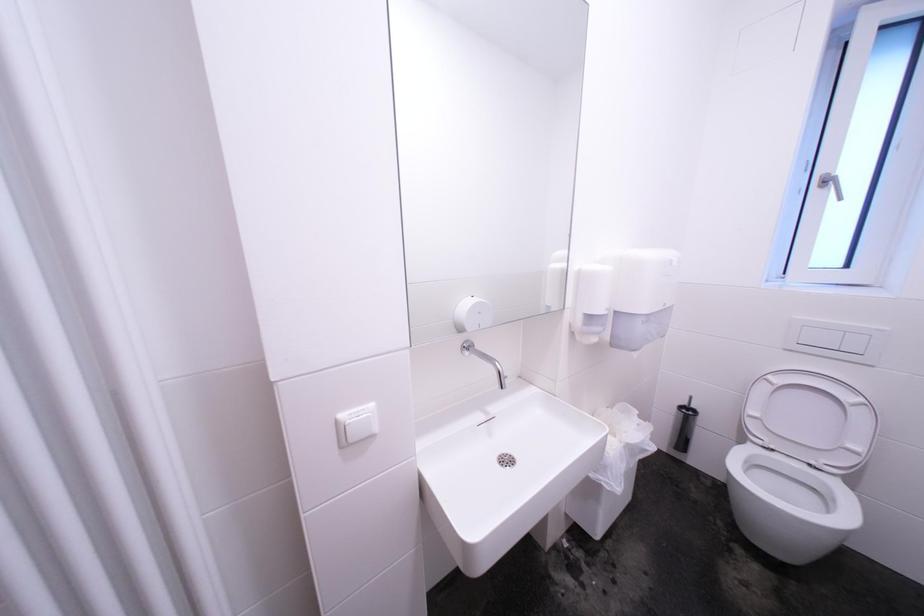
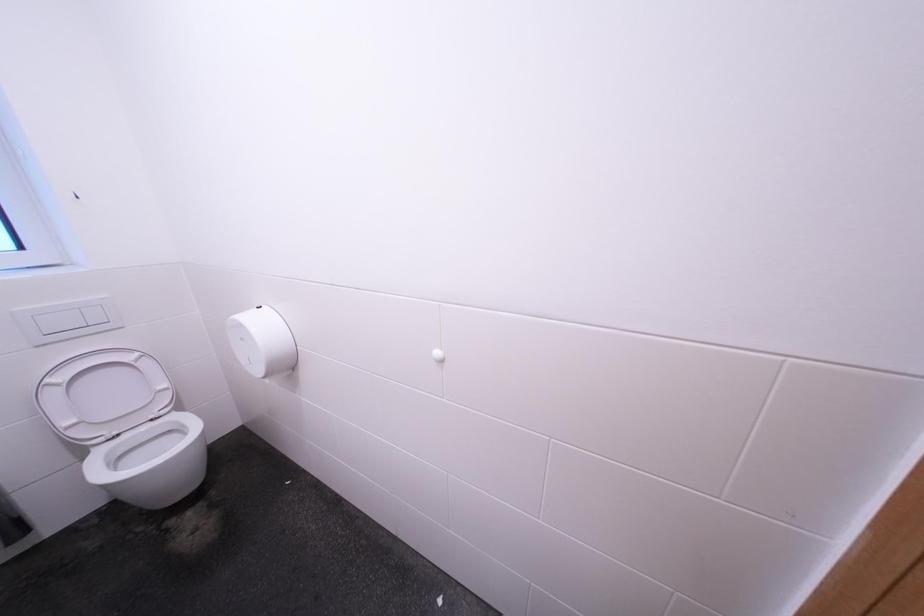
The images are taken continuously from a first-person perspective. In which direction is your viewpoint rotating?

The rotation direction of the camera is right-down.